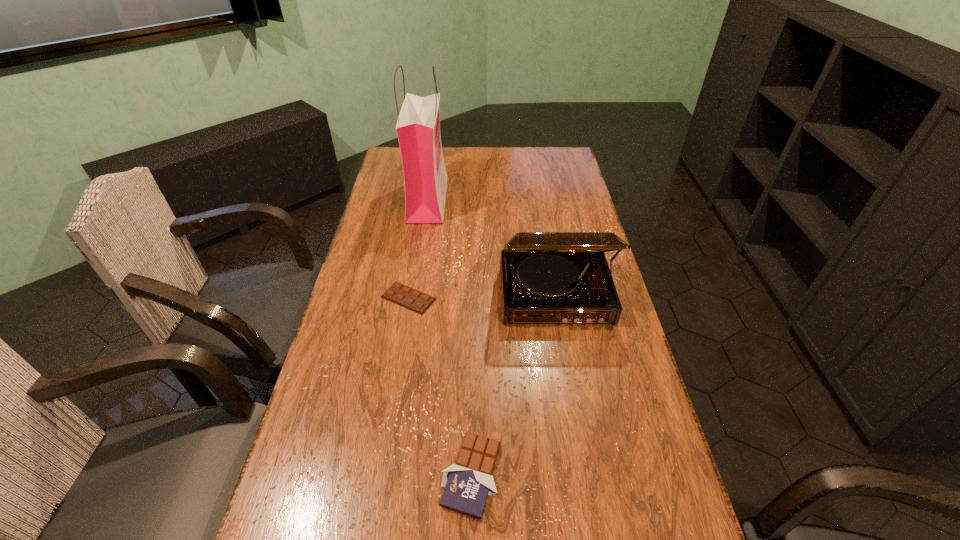
Locate an element on the screen. The width and height of the screenshot is (960, 540). vacant point located between the shopping bag and the record player is located at coordinates (492, 247).

Locate an element on the screen. Image resolution: width=960 pixels, height=540 pixels. free space between the left chocolate bar and the tallest object is located at coordinates (419, 248).

Locate an element on the screen. free spot between the record player and the right chocolate bar is located at coordinates (514, 385).

Where is `vacant area that lies between the shorter chocolate bar and the tallest object`? vacant area that lies between the shorter chocolate bar and the tallest object is located at coordinates (419, 248).

I want to click on unoccupied area between the second tallest object and the shopping bag, so click(x=492, y=247).

Where is `vacant space that is in between the shortest object and the rightmost object`? The width and height of the screenshot is (960, 540). vacant space that is in between the shortest object and the rightmost object is located at coordinates (482, 296).

The height and width of the screenshot is (540, 960). What are the coordinates of `empty location between the shorter chocolate bar and the right chocolate bar` in the screenshot? It's located at (440, 387).

Where is `blank region between the second tallest object and the nearer chocolate bar`? This screenshot has height=540, width=960. blank region between the second tallest object and the nearer chocolate bar is located at coordinates (514, 385).

The width and height of the screenshot is (960, 540). In order to click on object that is the second nearest to the second shortest object in this screenshot , I will do `click(412, 299)`.

At what (x,y) coordinates should I click in order to perform the action: click on object identified as the closest to the shorter chocolate bar. Please return your answer as a coordinate pair (x, y). The height and width of the screenshot is (540, 960). Looking at the image, I should click on (546, 277).